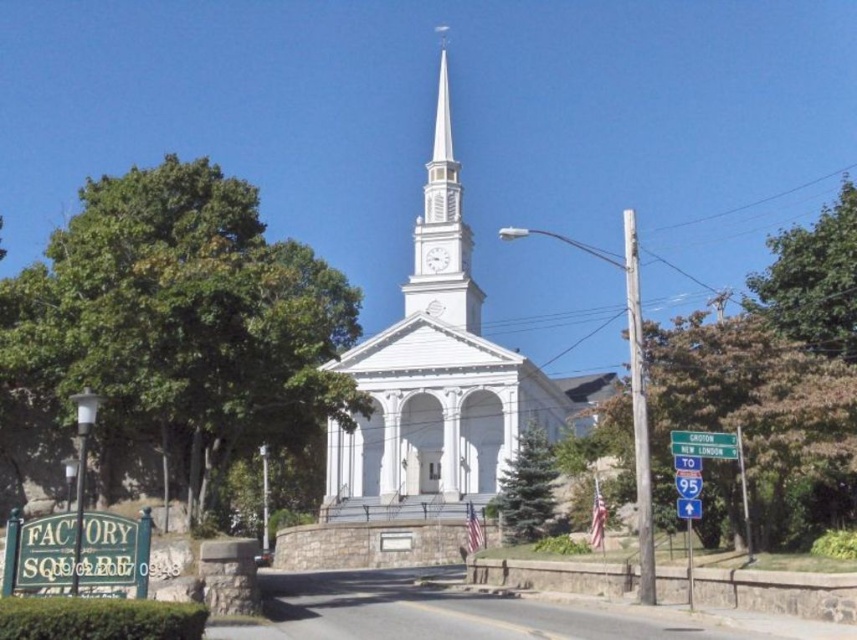
You are standing at the entrance of the church and want to locate the white smooth steeple at center. According to the scene description, where would you expect to find it?

The white smooth steeple at center is located at the central part of the church structure, as indicated by its name and the description mentioning it is centered around the white church with a tall steeple.